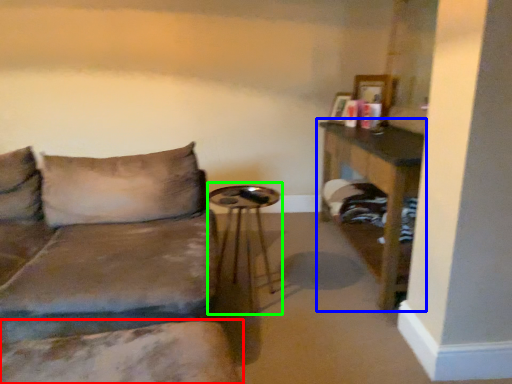
Question: Based on their relative distances, which object is farther from swivel chair (highlighted by a red box)? Choose from table (highlighted by a blue box) and side table (highlighted by a green box).

Choices:
 (A) table
 (B) side table

Answer: (A)